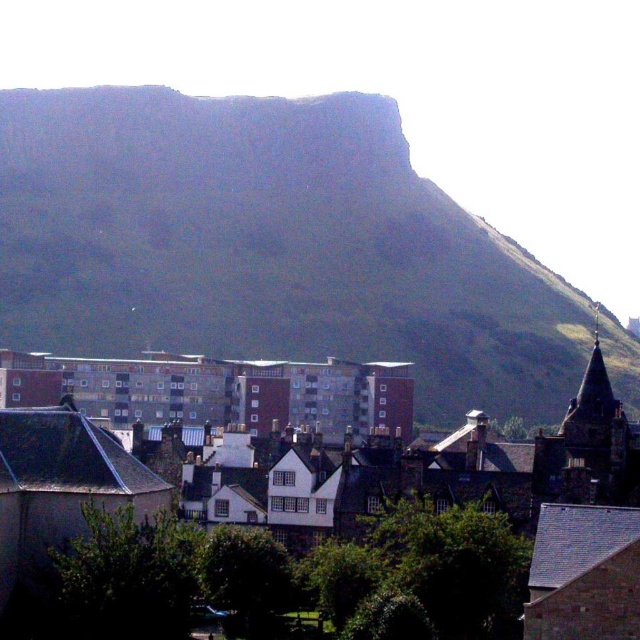
Which of these two, brown brick town at center or brick apartment building at center, stands taller?

With more height is brown brick town at center.

Locate an element on the screen. The height and width of the screenshot is (640, 640). brown brick town at center is located at coordinates (312, 522).

Does point (264, 316) lie behind point (189, 586)?

Yes.

Can you confirm if green grassy hill at upper center is thinner than brown brick town at center?

In fact, green grassy hill at upper center might be wider than brown brick town at center.

Identify the location of green grassy hill at upper center. The width and height of the screenshot is (640, 640). (268, 244).

Locate an element on the screen. green grassy hill at upper center is located at coordinates (268, 244).

Does green grassy hill at upper center have a greater height compared to brick apartment building at center?

Indeed, green grassy hill at upper center has a greater height compared to brick apartment building at center.

Is green grassy hill at upper center smaller than brick apartment building at center?

Actually, green grassy hill at upper center might be larger than brick apartment building at center.

Locate an element on the screen. This screenshot has width=640, height=640. green grassy hill at upper center is located at coordinates (268, 244).